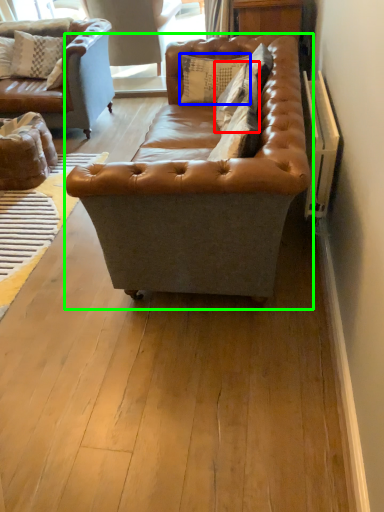
Question: Which is nearer to the pillow (highlighted by a red box)? pillow (highlighted by a blue box) or studio couch (highlighted by a green box).

Choices:
 (A) pillow
 (B) studio couch

Answer: (A)